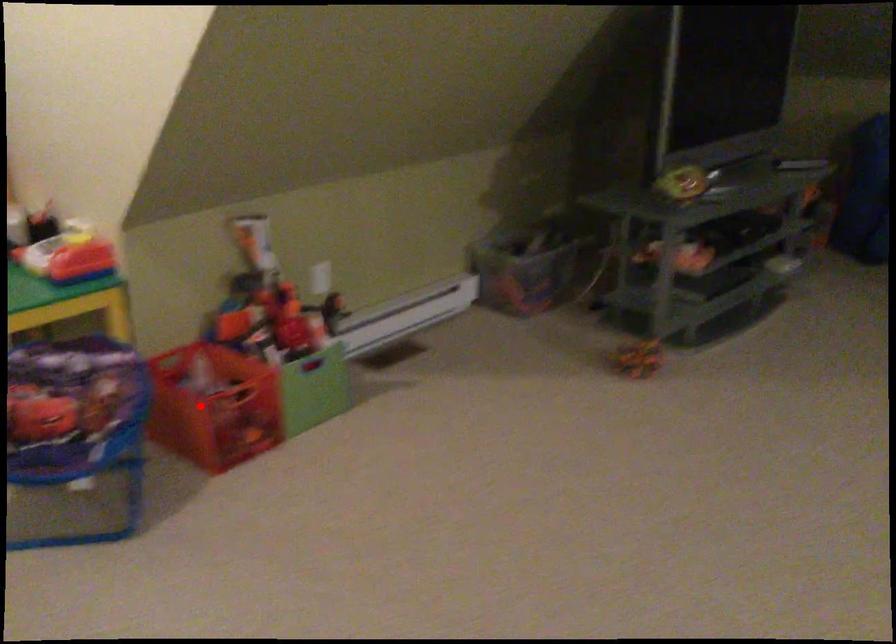
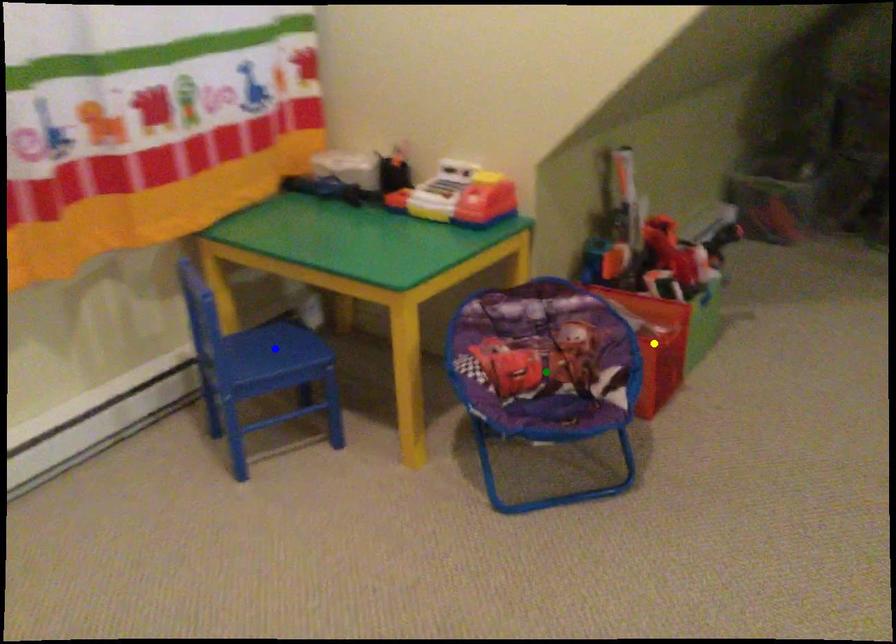
Question: I am providing you with two images of the same scene from different viewpoints. A red point is marked on the first image. You are given multiple points on the second image. Which point in image 2 is actually the same real-world point as the red point in image 1?

Choices:
 (A) blue point
 (B) yellow point
 (C) green point

Answer: (B)